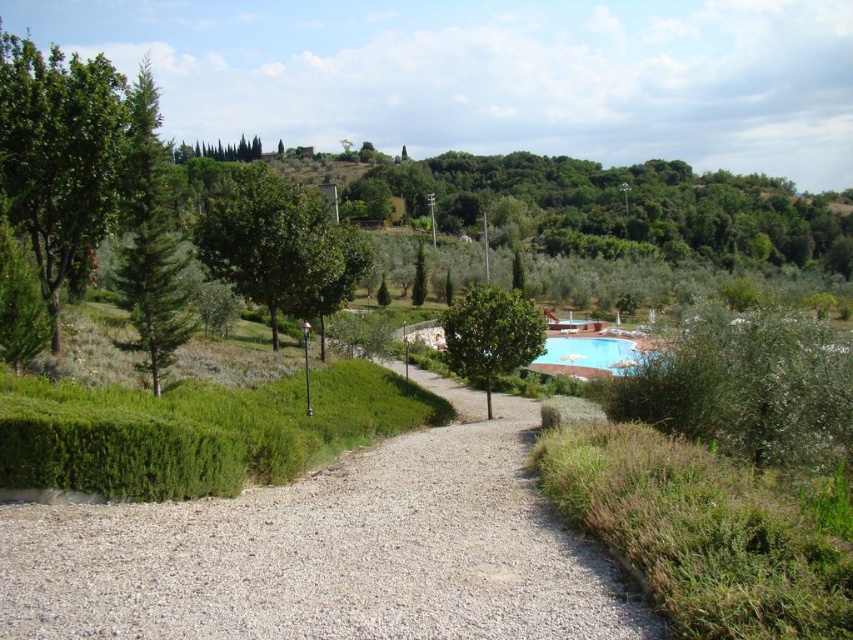
You are a guest staying at this estate and want to know if the green textured pine tree at left will block the view of the blue glossy pool at center from your current position. Can you see the pool clearly?

The green textured pine tree at left is much taller than the blue glossy pool at center, so it may block the view depending on your angle and distance. However, since the pool is at the center and the tree is at the left, if you are positioned towards the right side of the path, you should have a clear view of the blue glossy pool at center.